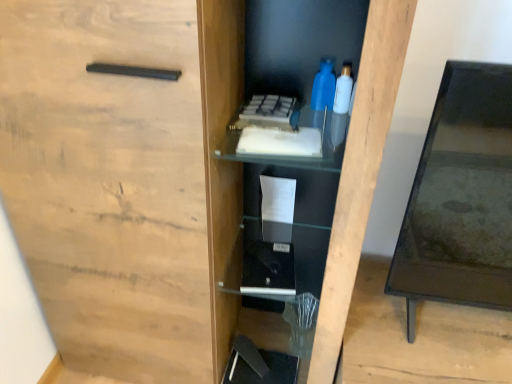
At what (x,y) coordinates should I click in order to perform the action: click on translucent plastic bottle at upper right, the 1th bottle viewed from the right. Please return your answer as a coordinate pair (x, y). Looking at the image, I should click on (343, 89).

Can we say translucent plastic bottle at upper right, the 1th bottle viewed from the right, lies outside blue plastic bottle at upper center, which appears as the 2th bottle when viewed from the right?

Indeed, translucent plastic bottle at upper right, the 1th bottle viewed from the right, is completely outside blue plastic bottle at upper center, which appears as the 2th bottle when viewed from the right.

Is translucent plastic bottle at upper right, placed as the second bottle when sorted from left to right, oriented away from blue plastic bottle at upper center, which appears as the 2th bottle when viewed from the right?

translucent plastic bottle at upper right, placed as the second bottle when sorted from left to right, is not turned away from blue plastic bottle at upper center, which appears as the 2th bottle when viewed from the right.

At what (x,y) coordinates should I click in order to perform the action: click on bottle below the translucent plastic bottle at upper right, placed as the second bottle when sorted from left to right (from a real-world perspective). Please return your answer as a coordinate pair (x, y). Looking at the image, I should click on (324, 86).

From the image's perspective, which is above, translucent plastic bottle at upper right, placed as the second bottle when sorted from left to right, or blue plastic bottle at upper center, which appears as the 2th bottle when viewed from the right?

blue plastic bottle at upper center, which appears as the 2th bottle when viewed from the right, appears higher in the image.

Is blue plastic bottle at upper center, which appears as the 2th bottle when viewed from the right, completely or partially outside of black glass table at right?

Yes, blue plastic bottle at upper center, which appears as the 2th bottle when viewed from the right, is located beyond the bounds of black glass table at right.

Who is bigger, blue plastic bottle at upper center, arranged as the first bottle when viewed from the left, or black glass table at right?

black glass table at right.

From a real-world perspective, is blue plastic bottle at upper center, arranged as the first bottle when viewed from the left, above or below black glass table at right?

In terms of real-world spatial position, blue plastic bottle at upper center, arranged as the first bottle when viewed from the left, is above black glass table at right.

From the image's perspective, which is above, blue plastic bottle at upper center, arranged as the first bottle when viewed from the left, or black glass table at right?

blue plastic bottle at upper center, arranged as the first bottle when viewed from the left.

Which object is thinner, translucent plastic bottle at upper right, placed as the second bottle when sorted from left to right, or black glass table at right?

translucent plastic bottle at upper right, placed as the second bottle when sorted from left to right.

Is translucent plastic bottle at upper right, placed as the second bottle when sorted from left to right, next to black glass table at right?

No, translucent plastic bottle at upper right, placed as the second bottle when sorted from left to right, is not making contact with black glass table at right.

Is translucent plastic bottle at upper right, placed as the second bottle when sorted from left to right, not inside black glass table at right?

Yes, translucent plastic bottle at upper right, placed as the second bottle when sorted from left to right, is located beyond the bounds of black glass table at right.

From a real-world perspective, which object rests below the other?

black glass table at right, from a real-world perspective.

Which object is further away from the camera taking this photo, blue plastic bottle at upper center, arranged as the first bottle when viewed from the left, or translucent plastic bottle at upper right, placed as the second bottle when sorted from left to right?

blue plastic bottle at upper center, arranged as the first bottle when viewed from the left, is behind.

Are blue plastic bottle at upper center, arranged as the first bottle when viewed from the left, and translucent plastic bottle at upper right, placed as the second bottle when sorted from left to right, located far from each other?

No, blue plastic bottle at upper center, arranged as the first bottle when viewed from the left, is in close proximity to translucent plastic bottle at upper right, placed as the second bottle when sorted from left to right.

Does blue plastic bottle at upper center, arranged as the first bottle when viewed from the left, turn towards translucent plastic bottle at upper right, the 1th bottle viewed from the right?

No, blue plastic bottle at upper center, arranged as the first bottle when viewed from the left, is not turned towards translucent plastic bottle at upper right, the 1th bottle viewed from the right.

How much distance is there between blue plastic bottle at upper center, which appears as the 2th bottle when viewed from the right, and translucent plastic bottle at upper right, placed as the second bottle when sorted from left to right?

They are 2.71 centimeters apart.

Which of these two, black glass table at right or blue plastic bottle at upper center, arranged as the first bottle when viewed from the left, is wider?

Wider between the two is black glass table at right.

Is black glass table at right closer to camera compared to blue plastic bottle at upper center, arranged as the first bottle when viewed from the left?

Yes.

Based on their sizes in the image, would you say black glass table at right is bigger or smaller than blue plastic bottle at upper center, which appears as the 2th bottle when viewed from the right?

In the image, black glass table at right appears to be larger than blue plastic bottle at upper center, which appears as the 2th bottle when viewed from the right.

Does point (493, 301) lie in front of point (316, 98)?

No, it is not.

Does black glass table at right turn towards translucent plastic bottle at upper right, placed as the second bottle when sorted from left to right?

No, black glass table at right is not aimed at translucent plastic bottle at upper right, placed as the second bottle when sorted from left to right.

Considering the positions of points (405, 255) and (351, 69), is point (405, 255) farther from camera compared to point (351, 69)?

Yes, it is.

Is black glass table at right outside of translucent plastic bottle at upper right, the 1th bottle viewed from the right?

Yes, black glass table at right is outside of translucent plastic bottle at upper right, the 1th bottle viewed from the right.

Looking at the image, does black glass table at right seem bigger or smaller compared to translucent plastic bottle at upper right, the 1th bottle viewed from the right?

Considering their sizes, black glass table at right takes up more space than translucent plastic bottle at upper right, the 1th bottle viewed from the right.

The height and width of the screenshot is (384, 512). Identify the location of bottle located on the right of blue plastic bottle at upper center, arranged as the first bottle when viewed from the left. (343, 89).

Image resolution: width=512 pixels, height=384 pixels. I want to click on table in front of the blue plastic bottle at upper center, which appears as the 2th bottle when viewed from the right, so click(461, 198).

Estimate the real-world distances between objects in this image. Which object is further from translucent plastic bottle at upper right, the 1th bottle viewed from the right, blue plastic bottle at upper center, arranged as the first bottle when viewed from the left, or black glass table at right?

black glass table at right lies further to translucent plastic bottle at upper right, the 1th bottle viewed from the right, than the other object.

From the image, which object appears to be farther from black glass table at right, translucent plastic bottle at upper right, placed as the second bottle when sorted from left to right, or blue plastic bottle at upper center, arranged as the first bottle when viewed from the left?

blue plastic bottle at upper center, arranged as the first bottle when viewed from the left.

From the picture: Based on their spatial positions, is black glass table at right or blue plastic bottle at upper center, arranged as the first bottle when viewed from the left, closer to translucent plastic bottle at upper right, placed as the second bottle when sorted from left to right?

Among the two, blue plastic bottle at upper center, arranged as the first bottle when viewed from the left, is located nearer to translucent plastic bottle at upper right, placed as the second bottle when sorted from left to right.

When comparing their distances from black glass table at right, does blue plastic bottle at upper center, which appears as the 2th bottle when viewed from the right, or translucent plastic bottle at upper right, the 1th bottle viewed from the right, seem further?

blue plastic bottle at upper center, which appears as the 2th bottle when viewed from the right, lies further to black glass table at right than the other object.

Estimate the real-world distances between objects in this image. Which object is closer to blue plastic bottle at upper center, arranged as the first bottle when viewed from the left, translucent plastic bottle at upper right, the 1th bottle viewed from the right, or black glass table at right?

Among the two, translucent plastic bottle at upper right, the 1th bottle viewed from the right, is located nearer to blue plastic bottle at upper center, arranged as the first bottle when viewed from the left.

Considering their positions, is black glass table at right positioned closer to blue plastic bottle at upper center, which appears as the 2th bottle when viewed from the right, than translucent plastic bottle at upper right, the 1th bottle viewed from the right?

translucent plastic bottle at upper right, the 1th bottle viewed from the right, is positioned closer to the anchor blue plastic bottle at upper center, which appears as the 2th bottle when viewed from the right.

You are a GUI agent. You are given a task and a screenshot of the screen. Output one action in this format:
    pyautogui.click(x=<x>, y=<y>)
    Task: Click on the bottle between black glass table at right and blue plastic bottle at upper center, arranged as the first bottle when viewed from the left, in the front-back direction
    This screenshot has height=384, width=512.
    Given the screenshot: What is the action you would take?
    pyautogui.click(x=343, y=89)